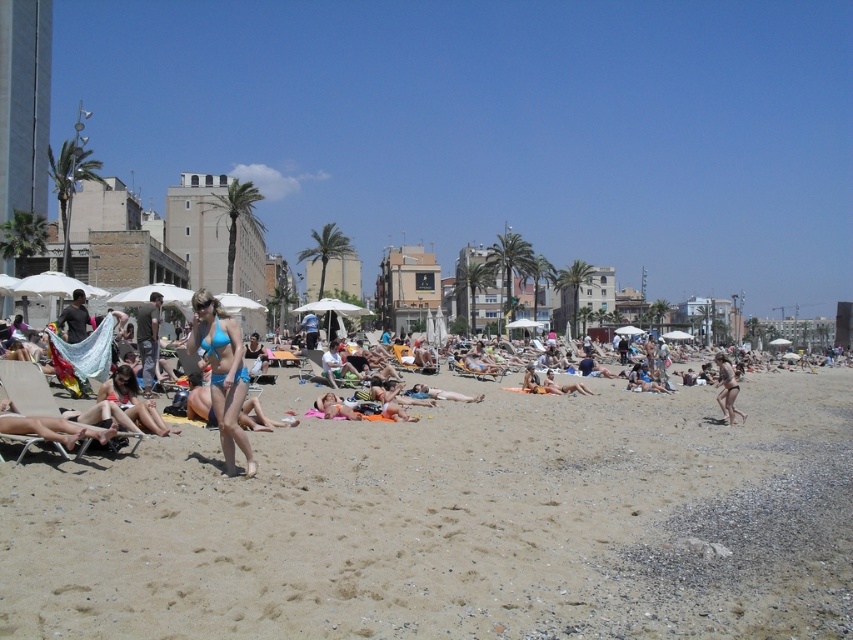
Question: Does fine-grained sand at center have a larger size compared to blue bikini at center?

Choices:
 (A) yes
 (B) no

Answer: (B)

Question: Which point appears closest to the camera in this image?

Choices:
 (A) (242, 452)
 (B) (480, 595)
 (C) (659, 445)

Answer: (B)

Question: From the image, what is the correct spatial relationship of blue matte bikini at center in relation to matte blue bikini at right?

Choices:
 (A) above
 (B) below

Answer: (A)

Question: Estimate the real-world distances between objects in this image. Which object is closer to the matte blue bikini at right?

Choices:
 (A) blue bikini at center
 (B) fine-grained sand at center

Answer: (A)

Question: Can you confirm if blue matte bikini at center is positioned below matte blue bikini at right?

Choices:
 (A) yes
 (B) no

Answer: (B)

Question: Estimate the real-world distances between objects in this image. Which object is farther from the fine-grained sand at center?

Choices:
 (A) blue bikini at center
 (B) matte blue bikini at right

Answer: (B)